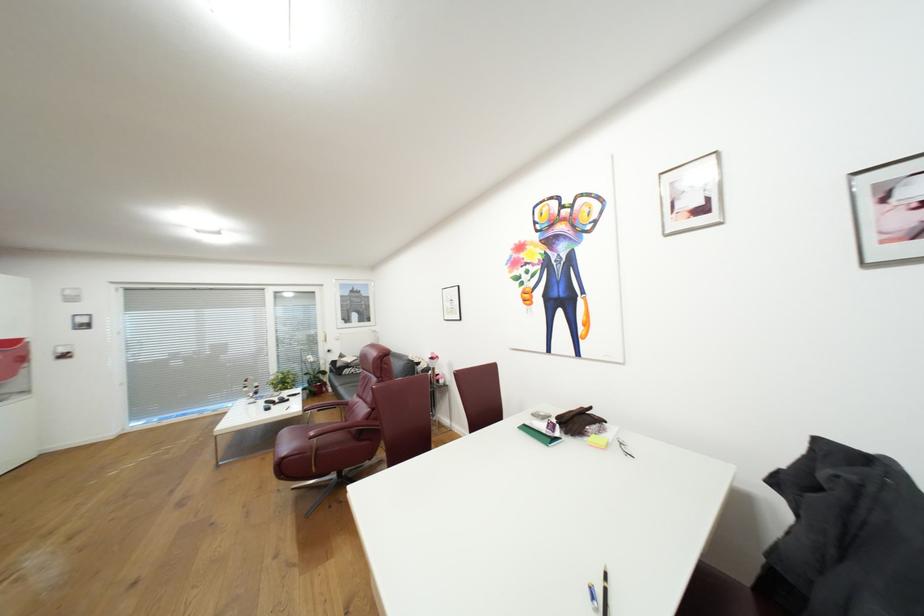
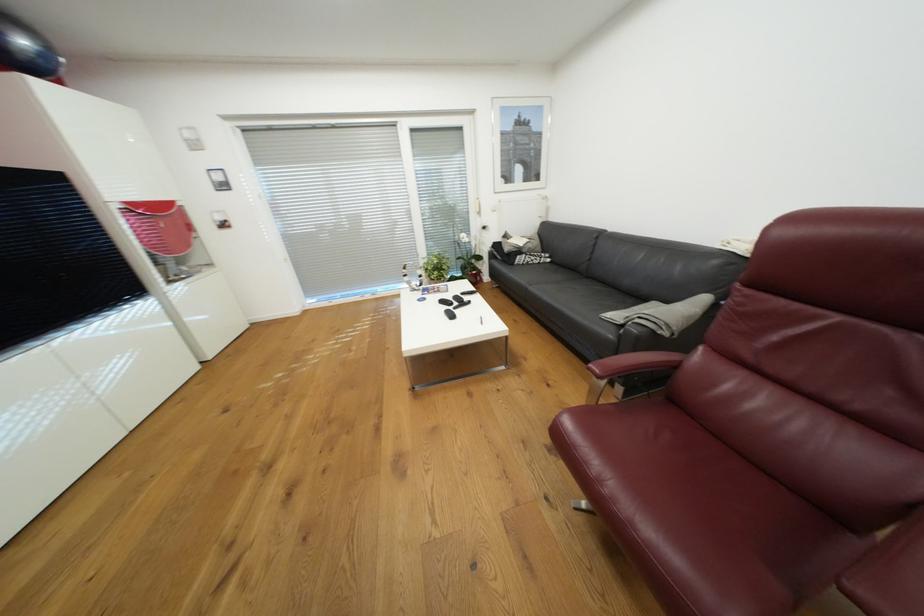
The point at (79, 299) is marked in the first image. Where is the corresponding point in the second image?

(201, 145)